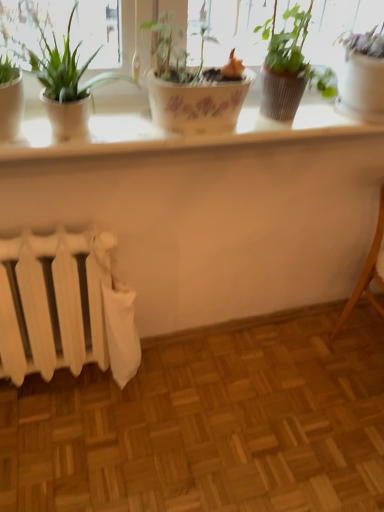
Describe the element at coordinates (10, 98) in the screenshot. I see `green glossy plant at left, marked as the first houseplant in a left-to-right arrangement` at that location.

This screenshot has width=384, height=512. What are the coordinates of `white matte radiator at lower left` in the screenshot? It's located at (55, 301).

Locate an element on the screen. white glossy counter top at upper center is located at coordinates (175, 133).

Image resolution: width=384 pixels, height=512 pixels. Find the location of `green glossy plant at left, the 4th houseplant from the right`. green glossy plant at left, the 4th houseplant from the right is located at coordinates (10, 98).

I want to click on the 2nd houseplant behind the green matte plant at left, the 2th houseplant from the left, counting from the anchor's position, so click(x=289, y=66).

From the image's perspective, which is below, green matte pot at upper center, the 3th houseplant viewed from the left, or green matte plant at left, placed as the 3th houseplant when sorted from right to left?

green matte plant at left, placed as the 3th houseplant when sorted from right to left, from the image's perspective.

Is green matte pot at upper center, which is counted as the second houseplant, starting from the right, far away from green matte plant at left, the 2th houseplant from the left?

No.

From the image's perspective, which is below, white matte radiator at lower left or green glossy plant at left, the 4th houseplant from the right?

From the image's view, white matte radiator at lower left is below.

From a real-world perspective, does white matte radiator at lower left stand above green glossy plant at left, the 4th houseplant from the right?

No, from a real-world perspective, white matte radiator at lower left is not over green glossy plant at left, the 4th houseplant from the right

Which object is thinner, white matte radiator at lower left or green glossy plant at left, the 4th houseplant from the right?

With smaller width is green glossy plant at left, the 4th houseplant from the right.

Is white matte radiator at lower left far away from green glossy plant at left, the 4th houseplant from the right?

That's not correct — white matte radiator at lower left is a little close to green glossy plant at left, the 4th houseplant from the right.

Is white matte radiator at lower left to the right of white glossy pot at upper right, the fourth houseplant when ordered from left to right, from the viewer's perspective?

In fact, white matte radiator at lower left is to the left of white glossy pot at upper right, the fourth houseplant when ordered from left to right.

Would you consider white matte radiator at lower left to be distant from white glossy pot at upper right, the fourth houseplant when ordered from left to right?

Yes, white matte radiator at lower left is far from white glossy pot at upper right, the fourth houseplant when ordered from left to right.

Is white matte radiator at lower left facing towards white glossy pot at upper right, the fourth houseplant when ordered from left to right?

No, white matte radiator at lower left is not facing towards white glossy pot at upper right, the fourth houseplant when ordered from left to right.

Can you confirm if green matte pot at upper center, the 3th houseplant viewed from the left, is positioned to the right of light brown wooden chair at lower right?

No.

Considering the sizes of green matte pot at upper center, the 3th houseplant viewed from the left, and light brown wooden chair at lower right in the image, is green matte pot at upper center, the 3th houseplant viewed from the left, taller or shorter than light brown wooden chair at lower right?

green matte pot at upper center, the 3th houseplant viewed from the left, is shorter than light brown wooden chair at lower right.

Is green matte pot at upper center, which is counted as the second houseplant, starting from the right, spatially inside light brown wooden chair at lower right, or outside of it?

green matte pot at upper center, which is counted as the second houseplant, starting from the right, is located beyond the bounds of light brown wooden chair at lower right.

Could you measure the distance between green matte pot at upper center, which is counted as the second houseplant, starting from the right, and light brown wooden chair at lower right?

32.32 inches.

Looking at their sizes, would you say green glossy plant at left, marked as the first houseplant in a left-to-right arrangement, is wider or thinner than green matte pot at upper center, the 3th houseplant viewed from the left?

In the image, green glossy plant at left, marked as the first houseplant in a left-to-right arrangement, appears to be more narrow than green matte pot at upper center, the 3th houseplant viewed from the left.

From the image's perspective, is green glossy plant at left, marked as the first houseplant in a left-to-right arrangement, under green matte pot at upper center, the 3th houseplant viewed from the left?

Yes, from the image's perspective, green glossy plant at left, marked as the first houseplant in a left-to-right arrangement, is beneath green matte pot at upper center, the 3th houseplant viewed from the left.

From a real-world perspective, between green glossy plant at left, the 4th houseplant from the right, and green matte pot at upper center, the 3th houseplant viewed from the left, who is vertically higher?

green matte pot at upper center, the 3th houseplant viewed from the left, from a real-world perspective.

Is green glossy plant at left, marked as the first houseplant in a left-to-right arrangement, bigger than green matte pot at upper center, the 3th houseplant viewed from the left?

No, green glossy plant at left, marked as the first houseplant in a left-to-right arrangement, is not bigger than green matte pot at upper center, the 3th houseplant viewed from the left.

Can we say green matte pot at upper center, the 3th houseplant viewed from the left, lies outside green glossy plant at left, marked as the first houseplant in a left-to-right arrangement?

green matte pot at upper center, the 3th houseplant viewed from the left, lies outside green glossy plant at left, marked as the first houseplant in a left-to-right arrangement,'s area.

In the scene shown: Is green matte pot at upper center, the 3th houseplant viewed from the left, beside green glossy plant at left, marked as the first houseplant in a left-to-right arrangement?

No, green matte pot at upper center, the 3th houseplant viewed from the left, is not touching green glossy plant at left, marked as the first houseplant in a left-to-right arrangement.

Is point (333, 86) positioned behind point (10, 21)?

That is True.

Looking at this image, is green matte plant at left, the 2th houseplant from the left, inside the boundaries of white glossy counter top at upper center, or outside?

The correct answer is: outside.

The width and height of the screenshot is (384, 512). I want to click on counter top that is behind the green matte plant at left, placed as the 3th houseplant when sorted from right to left, so click(175, 133).

Between green matte plant at left, placed as the 3th houseplant when sorted from right to left, and white glossy counter top at upper center, which one has less height?

white glossy counter top at upper center is shorter.

In the scene shown: Is green matte plant at left, the 2th houseplant from the left, in contact with white glossy counter top at upper center?

No, green matte plant at left, the 2th houseplant from the left, is not with white glossy counter top at upper center.

Identify the location of the 2nd houseplant behind the green matte plant at left, placed as the 3th houseplant when sorted from right to left. (289, 66).

At what (x,y) coordinates should I click in order to perform the action: click on the 3rd houseplant in front of the white matte radiator at lower left. Please return your answer as a coordinate pair (x, y). Image resolution: width=384 pixels, height=512 pixels. Looking at the image, I should click on (10, 98).

Looking at the image, which one is located further to light brown wooden chair at lower right, white glossy pot at upper right, the fourth houseplant when ordered from left to right, or green matte plant at left, placed as the 3th houseplant when sorted from right to left?

Among the two, green matte plant at left, placed as the 3th houseplant when sorted from right to left, is located further to light brown wooden chair at lower right.

When comparing their distances from white glossy pot at upper right, the fourth houseplant when ordered from left to right, does green matte pot at upper center, which is counted as the second houseplant, starting from the right, or green matte plant at left, the 2th houseplant from the left, seem closer?

Among the two, green matte pot at upper center, which is counted as the second houseplant, starting from the right, is located nearer to white glossy pot at upper right, the fourth houseplant when ordered from left to right.

Looking at the image, which one is located further to white glossy counter top at upper center, green matte pot at upper center, the 3th houseplant viewed from the left, or light brown wooden chair at lower right?

Among the two, light brown wooden chair at lower right is located further to white glossy counter top at upper center.

When comparing their distances from green matte plant at left, the 2th houseplant from the left, does white glossy pot at upper right, marked as the first houseplant in a right-to-left arrangement, or white glossy counter top at upper center seem further?

white glossy pot at upper right, marked as the first houseplant in a right-to-left arrangement.

Consider the image. From the image, which object appears to be nearer to green matte pot at upper center, which is counted as the second houseplant, starting from the right, white glossy counter top at upper center or white matte radiator at lower left?

white glossy counter top at upper center is closer to green matte pot at upper center, which is counted as the second houseplant, starting from the right.

Based on their spatial positions, is green glossy plant at left, the 4th houseplant from the right, or white glossy counter top at upper center closer to green matte plant at left, the 2th houseplant from the left?

green glossy plant at left, the 4th houseplant from the right, is closer to green matte plant at left, the 2th houseplant from the left.

Based on their spatial positions, is white glossy counter top at upper center or green matte plant at left, the 2th houseplant from the left, closer to light brown wooden chair at lower right?

white glossy counter top at upper center is positioned closer to the anchor light brown wooden chair at lower right.

From the picture: Looking at the image, which one is located further to white glossy counter top at upper center, green matte pot at upper center, the 3th houseplant viewed from the left, or white glossy pot at upper right, marked as the first houseplant in a right-to-left arrangement?

white glossy pot at upper right, marked as the first houseplant in a right-to-left arrangement.

What are the coordinates of `houseplant between white glossy counter top at upper center and white glossy pot at upper right, marked as the first houseplant in a right-to-left arrangement, from left to right` in the screenshot? It's located at (289, 66).

The image size is (384, 512). I want to click on counter top located between white matte radiator at lower left and white glossy pot at upper right, marked as the first houseplant in a right-to-left arrangement, in the left-right direction, so click(175, 133).

You are a GUI agent. You are given a task and a screenshot of the screen. Output one action in this format:
    pyautogui.click(x=<x>, y=<y>)
    Task: Click on the counter top that lies between green matte plant at left, the 2th houseplant from the left, and white matte radiator at lower left from top to bottom
    
    Given the screenshot: What is the action you would take?
    pyautogui.click(x=175, y=133)

In order to click on counter top located between green glossy plant at left, the 4th houseplant from the right, and light brown wooden chair at lower right in the left-right direction in this screenshot , I will do `click(175, 133)`.